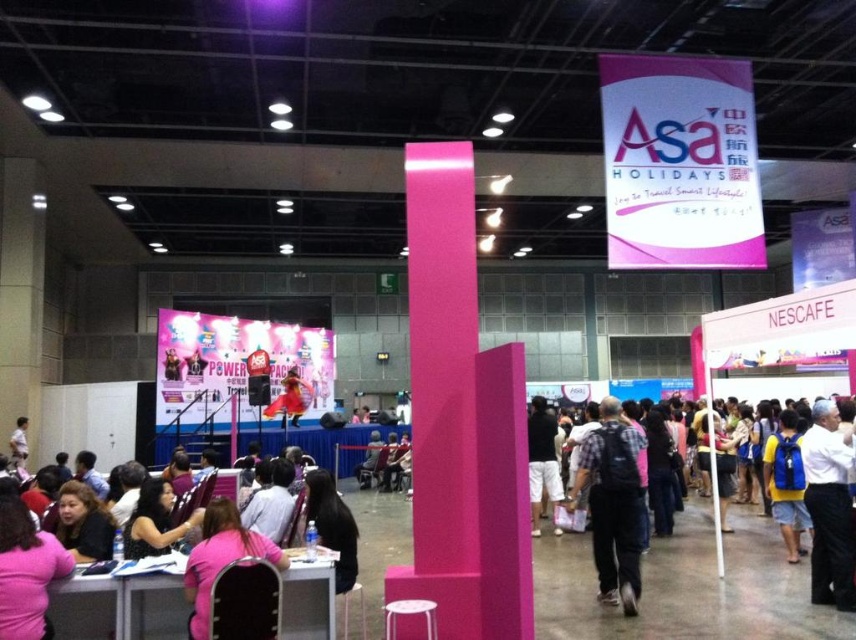
Question: Which of the following is the farthest from the observer?

Choices:
 (A) (322, 541)
 (B) (301, 408)

Answer: (B)

Question: Estimate the real-world distances between objects in this image. Which object is farther from the plaid shirt at center?

Choices:
 (A) pink fabric chair at lower left
 (B) plaid fabric shirt at center
 (C) black fabric at center

Answer: (A)

Question: Among these objects, which one is farthest from the camera?

Choices:
 (A) plaid shirt at center
 (B) pink fabric shirt at lower left

Answer: (A)

Question: Is white shirt at center wider than black fabric backpack at center?

Choices:
 (A) no
 (B) yes

Answer: (A)

Question: Is white shirt at center positioned in front of black fabric at center?

Choices:
 (A) no
 (B) yes

Answer: (A)

Question: Can you confirm if plaid shirt at center is bigger than white shirt at center?

Choices:
 (A) no
 (B) yes

Answer: (B)